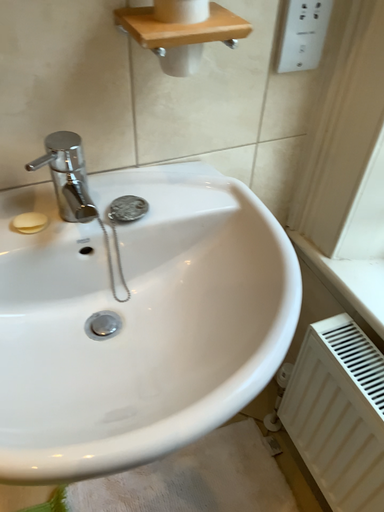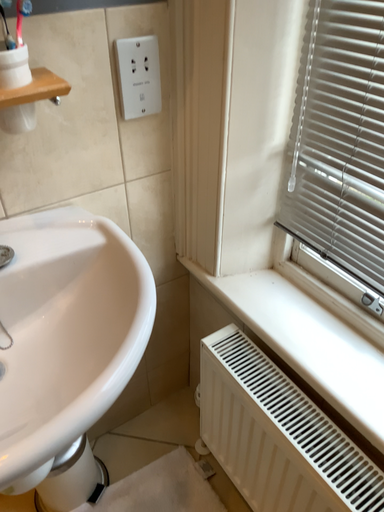
Question: Which way did the camera rotate in the video?

Choices:
 (A) rotated downward
 (B) rotated upward

Answer: (B)